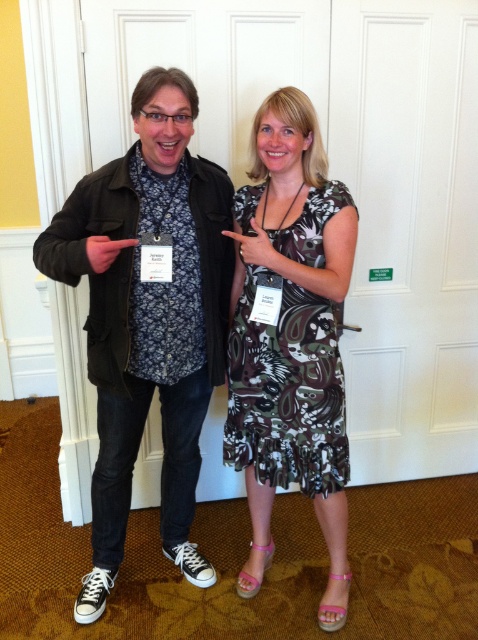
You are at a networking event and need to introduce yourself to both people in the image. Which person should you approach first if you want to greet the person wearing the black matte jacket at center before the printed fabric dress at center?

You should approach the black matte jacket at center first since it is located to the left of the printed fabric dress at center, meaning the person wearing it is on the left side and closer to your starting position.

You are an event organizer who needs to place a 12 inch wide decorative banner between the black matte jacket at center and the printed fabric dress at center. Can you fit the banner between them?

The black matte jacket at center and printed fabric dress at center are 10.87 inches apart from each other, so the 12 inch wide banner cannot fit between them as the space is smaller than the banner.